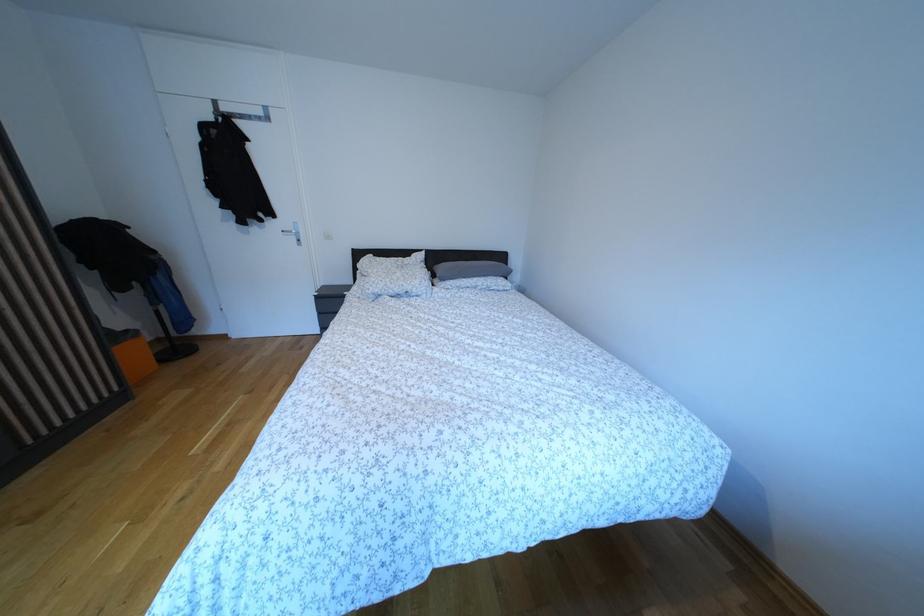
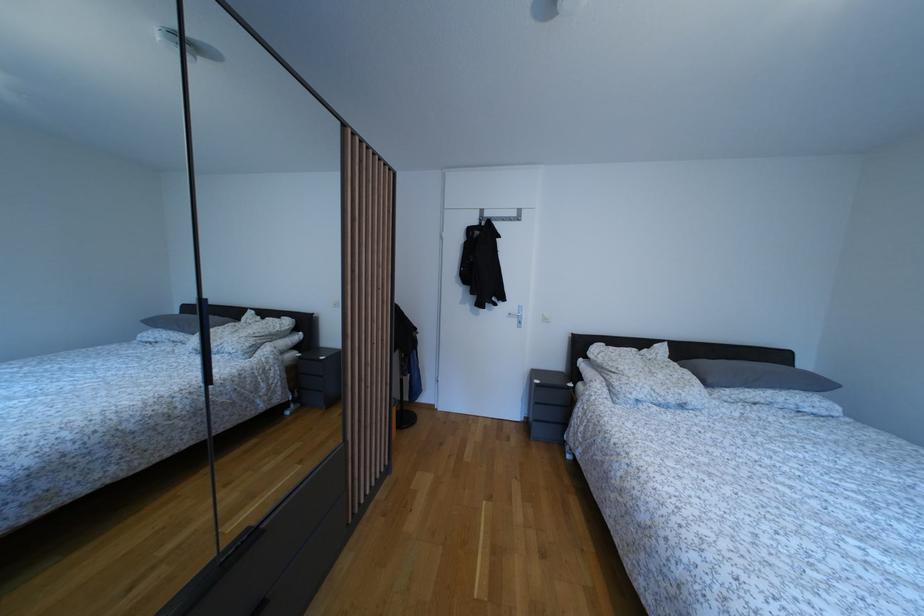
Question: The images are taken continuously from a first-person perspective. In which direction are you moving?

Choices:
 (A) Left
 (B) Right
 (C) Forward
 (D) Backward

Answer: (A)